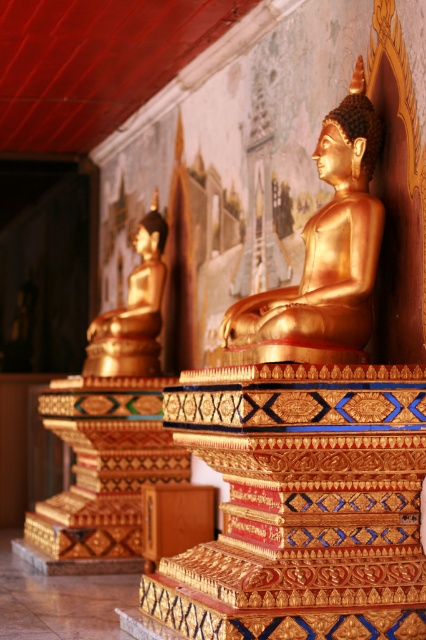
Question: Which point is farther from the camera taking this photo?

Choices:
 (A) (331, 218)
 (B) (123, 324)

Answer: (B)

Question: Is gold shiny statue at center below gold polished statue at left?

Choices:
 (A) no
 (B) yes

Answer: (A)

Question: In this image, where is gold shiny statue at center located relative to gold polished statue at left?

Choices:
 (A) right
 (B) left

Answer: (A)

Question: Does gold shiny statue at center have a lesser width compared to gold polished statue at left?

Choices:
 (A) no
 (B) yes

Answer: (A)